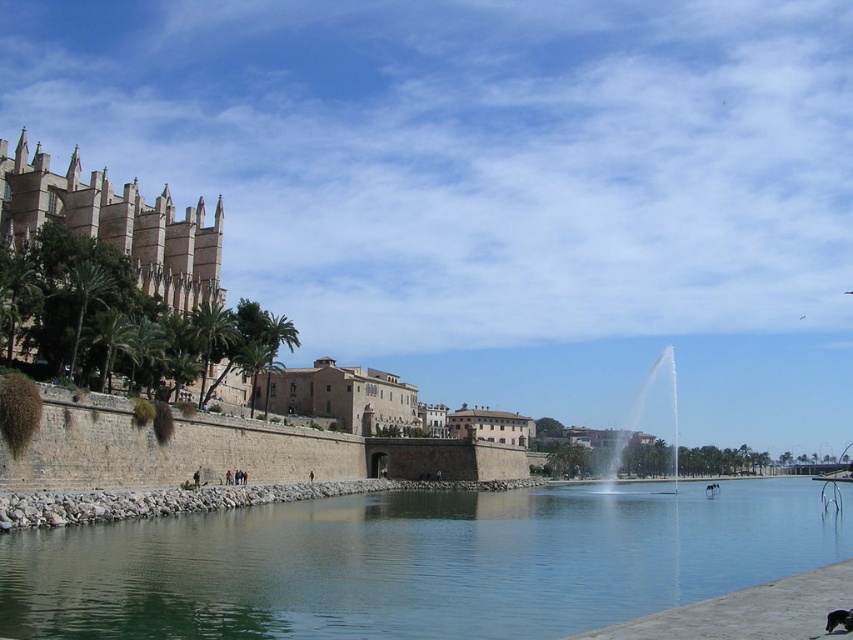
You are a photographer planning to capture the serene riverside scene. You want to ensure that both the clear water at center and the brown stone building at center are visible in your shot. Given that your camera has a fixed focal length, which object should you prioritize framing to ensure both are included?

Since the clear water at center is bigger than the brown stone building at center, you should prioritize framing the brown stone building at center first as it is smaller and requires less space to be fully captured while still allowing room for the larger clear water at center in the composition.

You are standing at the edge of the riverside scene and want to find the clear water at center. Based on the coordinates provided in the Objects Description, in which direction should you look relative to your position?

The clear water at center is located at coordinates point (415, 563), which means it is positioned towards the lower right of the image. Therefore, you should look towards the lower right direction from your current position at the edge of the riverside scene.

You are standing at the riverside and want to take a photo of the brown stone building at center without the clear water at center appearing in the foreground. Is this possible based on the scene description?

The clear water at center is in front of the brown stone building at center, so it will block the view. You need to move to a position where the water is not between you and the building to avoid it appearing in the foreground.